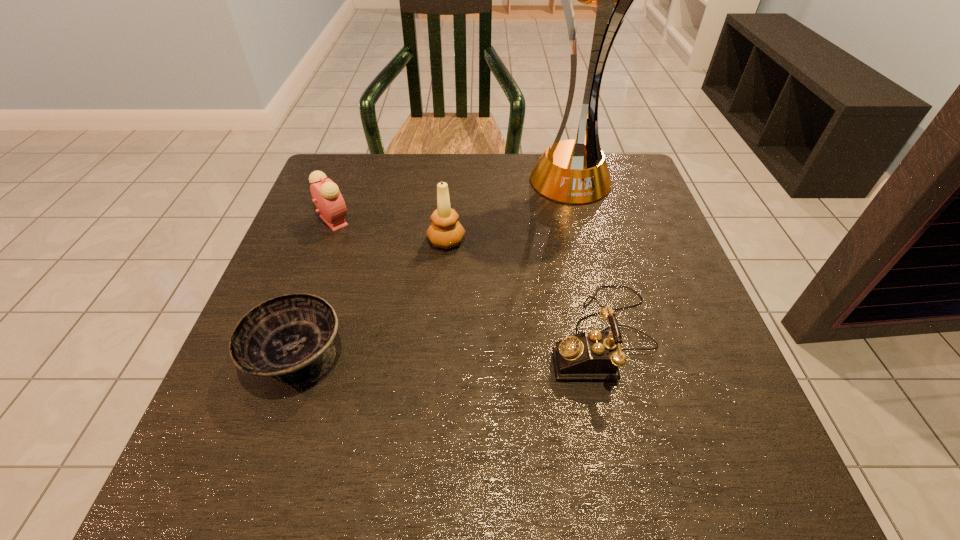
The width and height of the screenshot is (960, 540). I want to click on free location at the far edge, so click(425, 165).

You are a GUI agent. You are given a task and a screenshot of the screen. Output one action in this format:
    pyautogui.click(x=<x>, y=<y>)
    Task: Click on the blank space at the near edge of the desktop
    This screenshot has height=540, width=960.
    Given the screenshot: What is the action you would take?
    pyautogui.click(x=478, y=463)

This screenshot has height=540, width=960. Find the location of `blank space at the left edge of the desktop`. blank space at the left edge of the desktop is located at coordinates (290, 271).

The width and height of the screenshot is (960, 540). I want to click on vacant space at the right edge, so click(x=671, y=349).

Identify the location of vacant space at the far left corner. This screenshot has height=540, width=960. (351, 197).

In the image, there is a desktop. Find the location of `free region at the near left corner`. free region at the near left corner is located at coordinates (235, 464).

This screenshot has width=960, height=540. I want to click on vacant point at the far right corner, so 616,154.

Locate an element on the screen. vacant space at the near right corner of the desktop is located at coordinates (779, 478).

The height and width of the screenshot is (540, 960). Find the location of `vacant point located between the shortest object and the candle_holder`. vacant point located between the shortest object and the candle_holder is located at coordinates (372, 299).

Image resolution: width=960 pixels, height=540 pixels. In order to click on free spot between the trophy and the telephone in this screenshot , I will do (x=585, y=257).